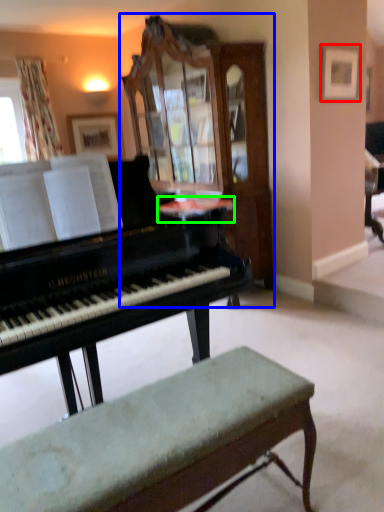
Question: Which is nearer to the picture frame (highlighted by a red box)? cabinetry (highlighted by a blue box) or table (highlighted by a green box).

Choices:
 (A) cabinetry
 (B) table

Answer: (A)